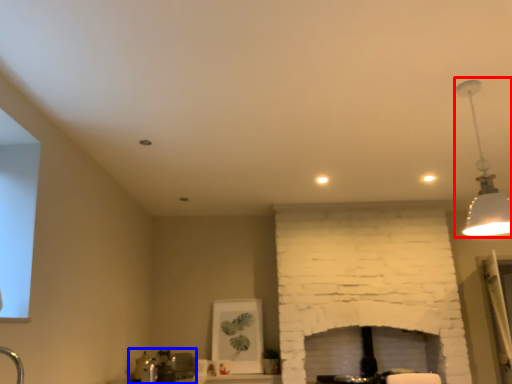
Question: Which point is closer to the camera, lamp (highlighted by a red box) or sink (highlighted by a blue box)?

Choices:
 (A) lamp
 (B) sink

Answer: (A)